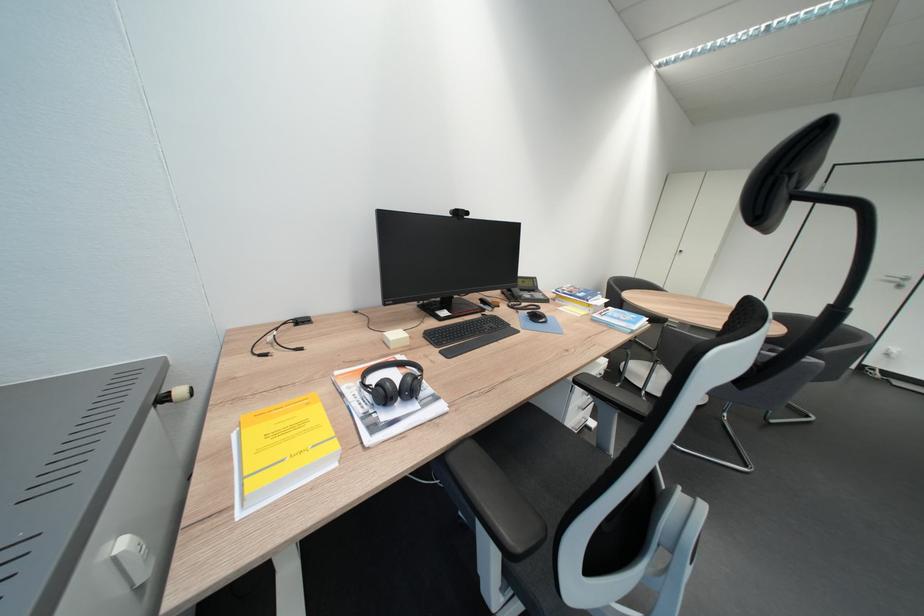
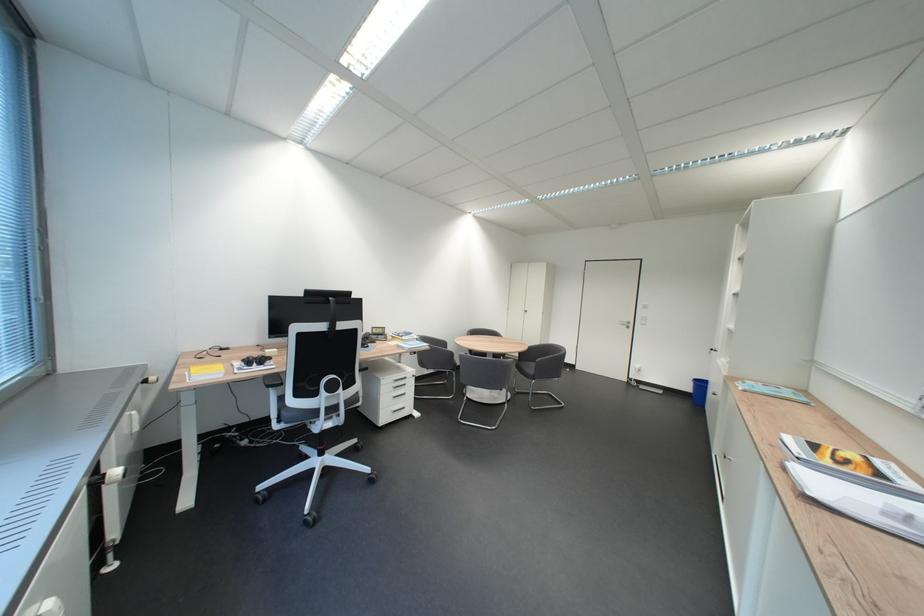
In a continuous first-person perspective shot, in which direction is the camera moving?

The movement direction of the cameraman is right, backward.